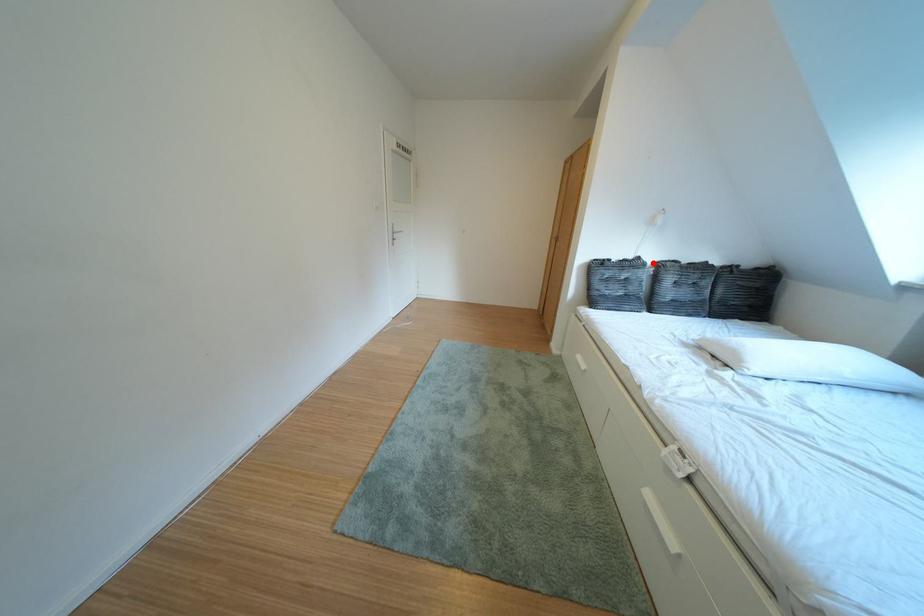
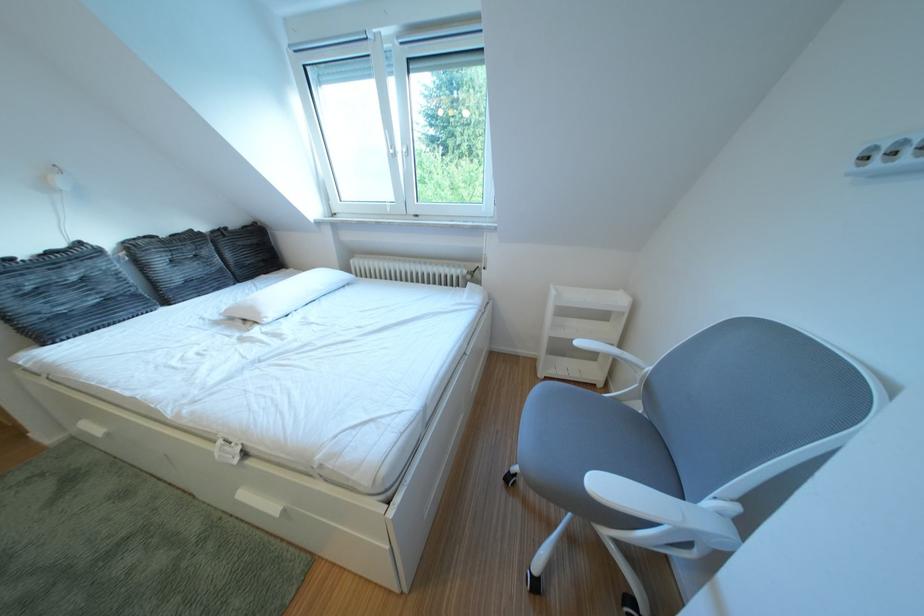
Find the pixel in the second image that matches the highlighted location in the first image.

(93, 249)